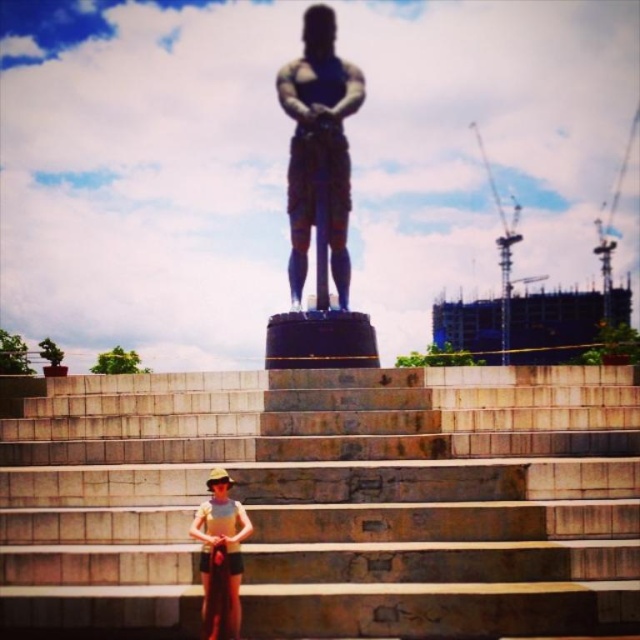
You are standing at the base of the statue and want to take a photo of the tan fabric shorts at center while also including the brown stone stairs at center in the frame. Which object should be closer to the camera to ensure both are visible?

The brown stone stairs at center is in front of the tan fabric shorts at center, so to include both in the photo, the stairs should be closer to the camera since they are already positioned in front of the shorts.

You are standing at the base of the statue and want to take a photo. You notice two points marked in the image. The first point is at coordinate point (124, 412) and the second point is at coordinate point (289, 74). Which point will appear larger in your photo?

Point (124, 412) is closer to the camera than point (289, 74), so it will appear larger in the photo.